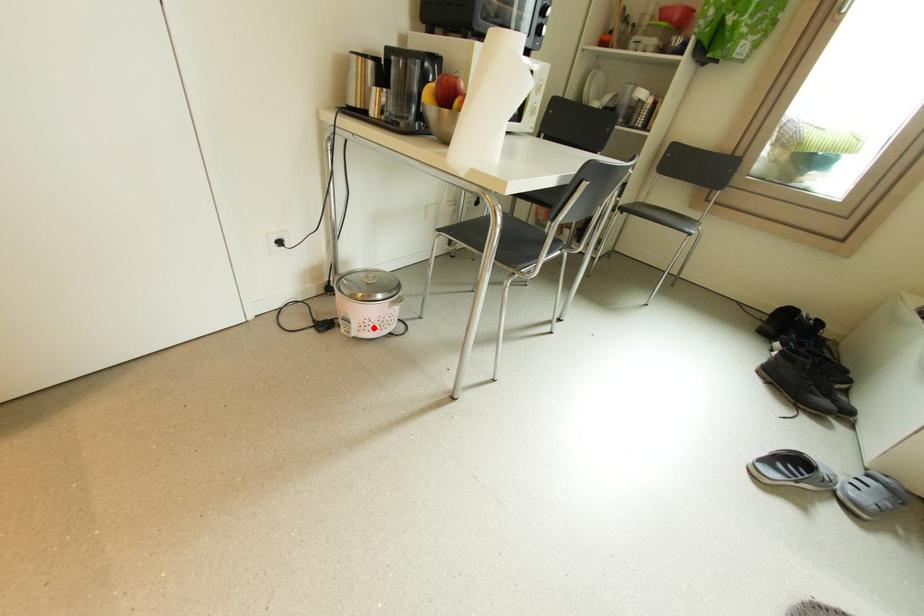
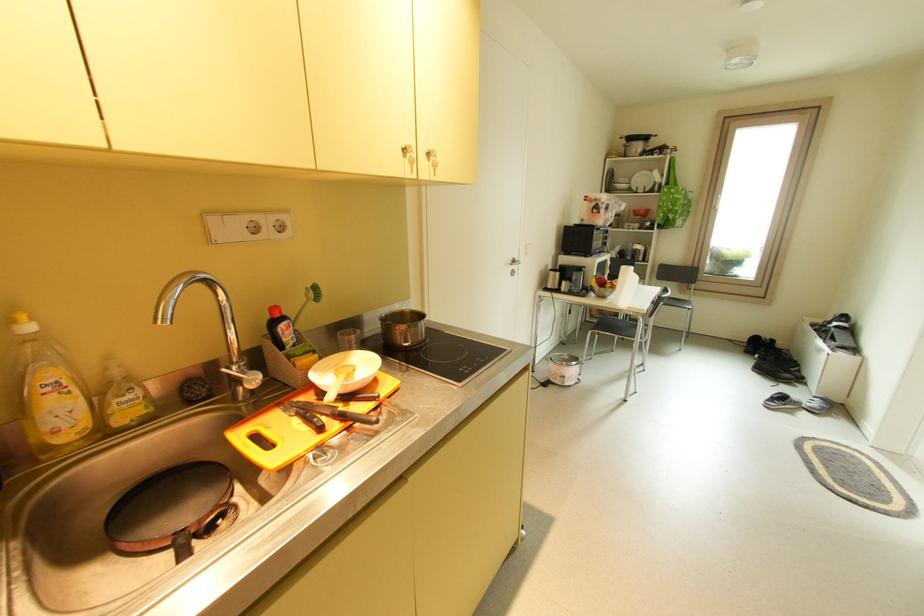
Question: I am providing you with two images of the same scene from different viewpoints. A red point is shown in image1. For the corresponding object point in image2, is it positioned nearer or farther from the camera?

Choices:
 (A) Nearer
 (B) Farther

Answer: (B)